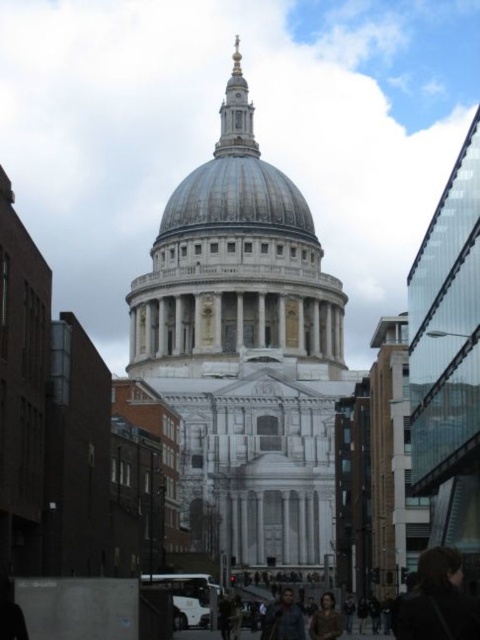
Question: Which is farther from the brown leather jacket at lower center?

Choices:
 (A) white marble cathedral at center
 (B) dark blue shirt at center

Answer: (A)

Question: Does dark brown hair at lower right appear under dark blue shirt at center?

Choices:
 (A) no
 (B) yes

Answer: (A)

Question: Among these objects, which one is nearest to the camera?

Choices:
 (A) white marble cathedral at center
 (B) dark brown hair at lower right

Answer: (B)

Question: Considering the relative positions of white marble cathedral at center and dark brown hair at lower right in the image provided, where is white marble cathedral at center located with respect to dark brown hair at lower right?

Choices:
 (A) left
 (B) right

Answer: (A)

Question: Which object is the closest to the dark blue shirt at center?

Choices:
 (A) brown leather jacket at lower center
 (B) white marble cathedral at center
 (C) dark brown hair at lower right

Answer: (A)

Question: Is dark blue shirt at center positioned behind brown leather jacket at lower center?

Choices:
 (A) yes
 (B) no

Answer: (B)